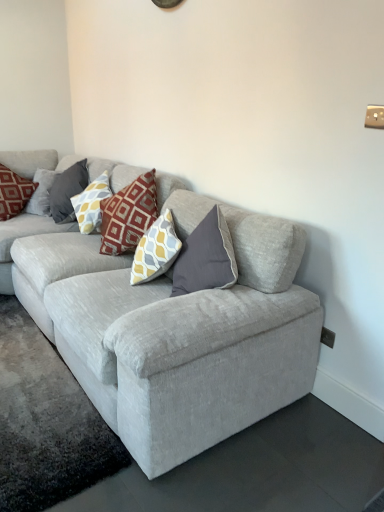
Question: Is point (77, 161) closer or farther from the camera than point (117, 318)?

Choices:
 (A) farther
 (B) closer

Answer: (A)

Question: Which is correct: yellow and gray patterned pillow at upper left, the 2th pillow in the right-to-left sequence, is inside light gray fabric couch at center, or outside of it?

Choices:
 (A) inside
 (B) outside

Answer: (A)

Question: Considering the real-world distances, which object is closest to the light gray fabric couch at center?

Choices:
 (A) yellow and gray patterned pillow at center, the first pillow from the right
 (B) matte red pillow at upper left, which appears as the 1th pillow when viewed from the left
 (C) yellow and gray patterned pillow at upper left, the 2th pillow in the right-to-left sequence

Answer: (A)

Question: Which is nearer to the yellow and gray patterned pillow at center, the 3th pillow when ordered from left to right?

Choices:
 (A) yellow and gray patterned pillow at upper left, the 2th pillow in the right-to-left sequence
 (B) matte red pillow at upper left, placed as the third pillow when sorted from right to left
 (C) light gray fabric couch at center

Answer: (A)